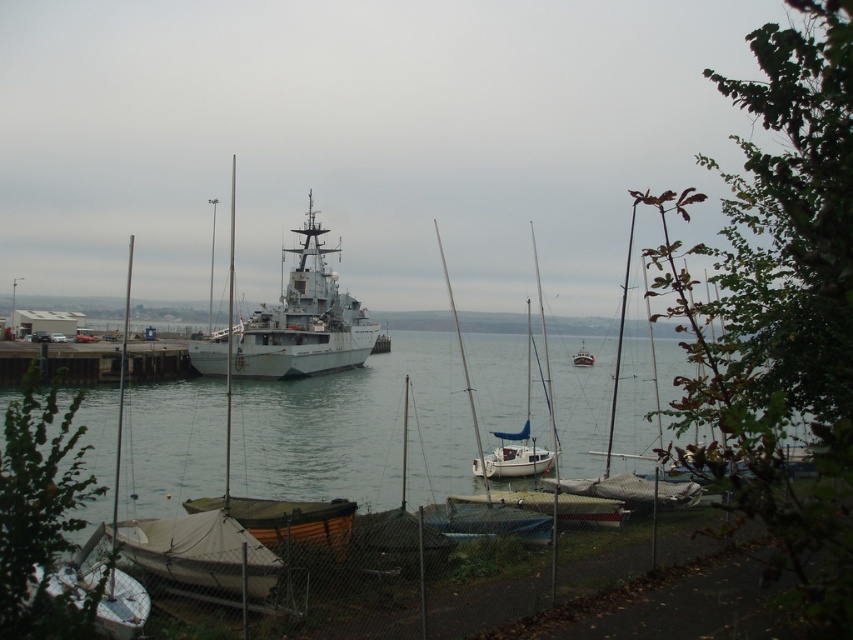
Question: Which of the following is the farthest from the observer?

Choices:
 (A) (300, 285)
 (B) (148, 528)
 (C) (148, 538)
 (D) (581, 342)

Answer: (D)

Question: Which object is farther from the camera taking this photo?

Choices:
 (A) white matte sailboat at center
 (B) white matte ship at center
 (C) white metallic ship at center

Answer: (A)

Question: Which point appears closest to the camera in this image?

Choices:
 (A) (579, 364)
 (B) (258, 529)
 (C) (183, 534)
 (D) (277, 374)

Answer: (C)

Question: Can you confirm if white metallic ship at center is smaller than white matte sailboat at center?

Choices:
 (A) yes
 (B) no

Answer: (B)

Question: Does white metallic ship at center appear on the right side of white matte sailboat at center?

Choices:
 (A) yes
 (B) no

Answer: (B)

Question: Can you confirm if white matte ship at center is positioned below white canvas boat at lower left?

Choices:
 (A) no
 (B) yes

Answer: (A)